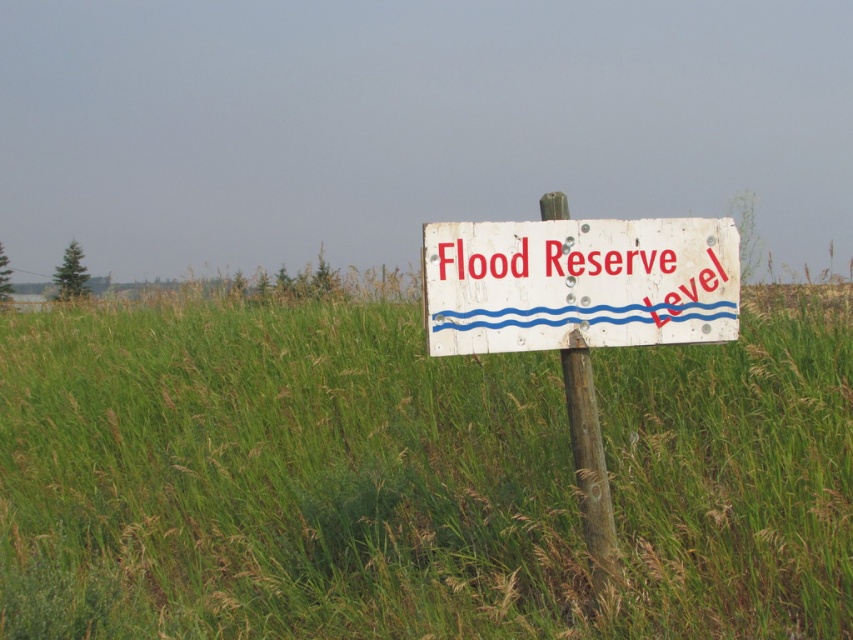
Who is taller, green grassy at center or white wooden sign at center?

With more height is white wooden sign at center.

The height and width of the screenshot is (640, 853). Identify the location of green grassy at center. (415, 477).